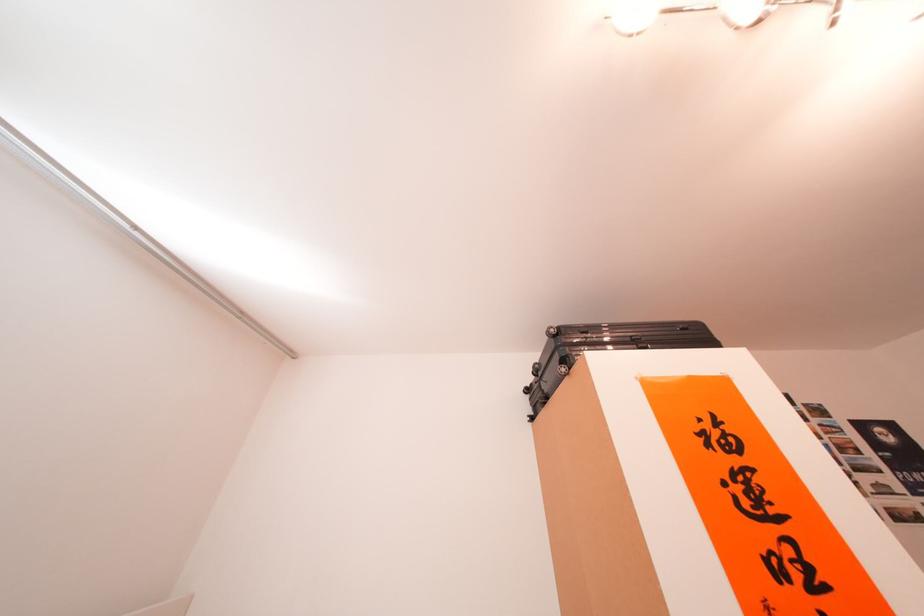
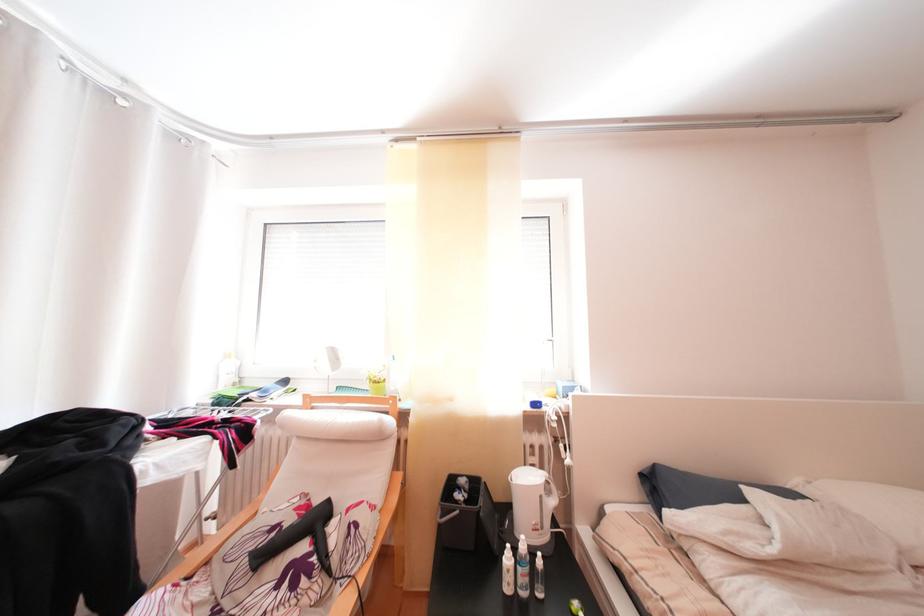
Question: The images are taken continuously from a first-person perspective. In which direction is your viewpoint rotating?

Choices:
 (A) Left
 (B) Right
 (C) Up
 (D) Down

Answer: (A)